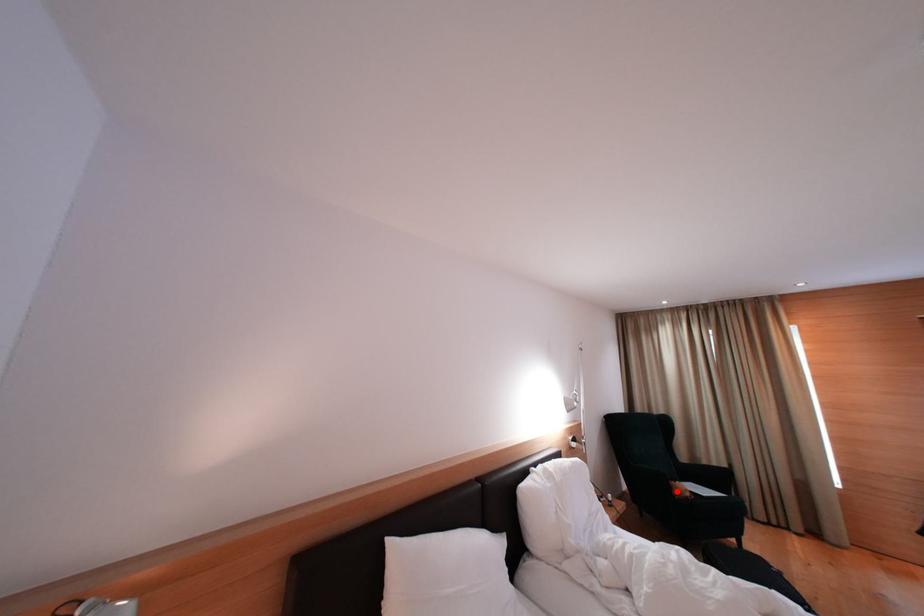
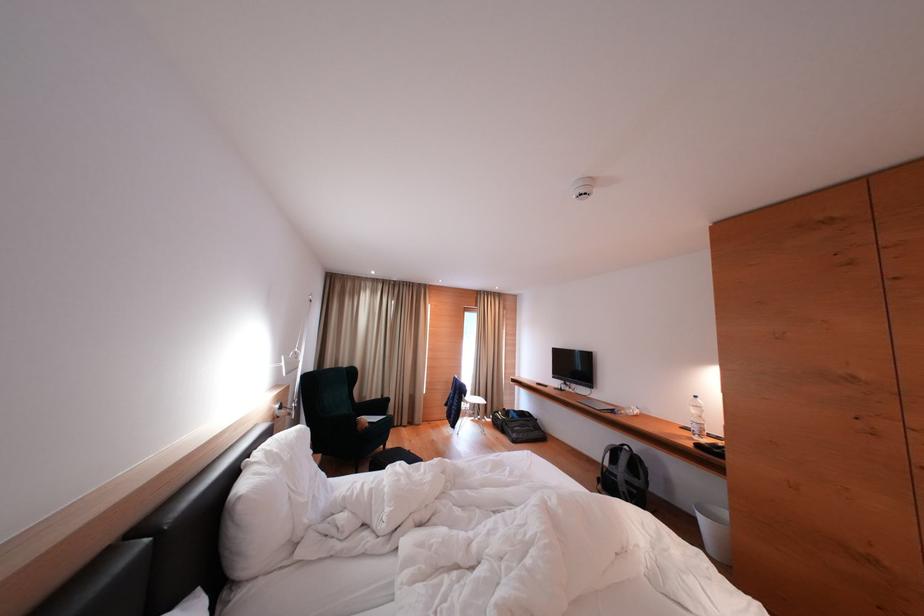
In the second image, find the point that corresponds to the highlighted location in the first image.

(362, 428)